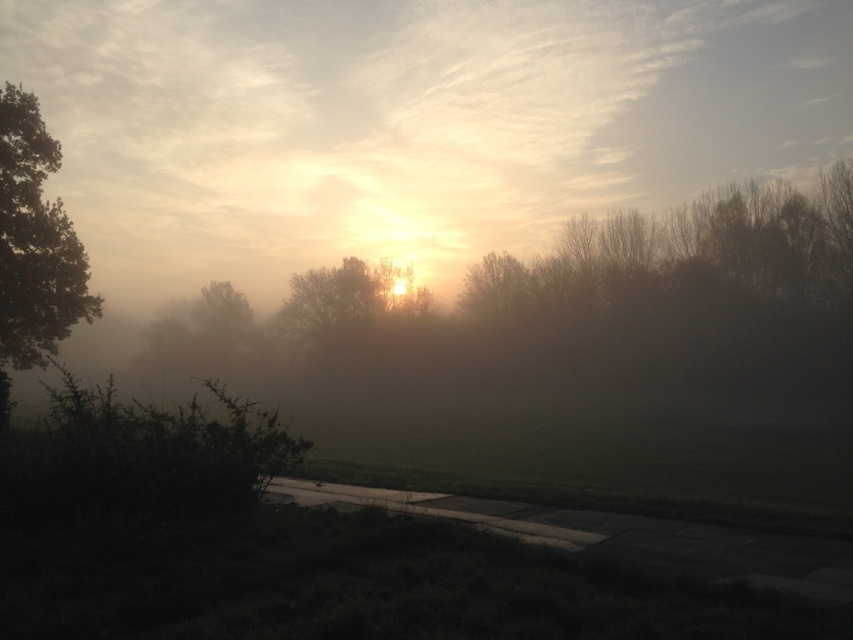
Is foggy sky at center shorter than green matte tree at left?

In fact, foggy sky at center may be taller than green matte tree at left.

Does foggy sky at center have a lesser width compared to green matte tree at left?

No, foggy sky at center is not thinner than green matte tree at left.

Locate an element on the screen. foggy sky at center is located at coordinates (407, 124).

Find the location of `foggy sky at center`. foggy sky at center is located at coordinates (407, 124).